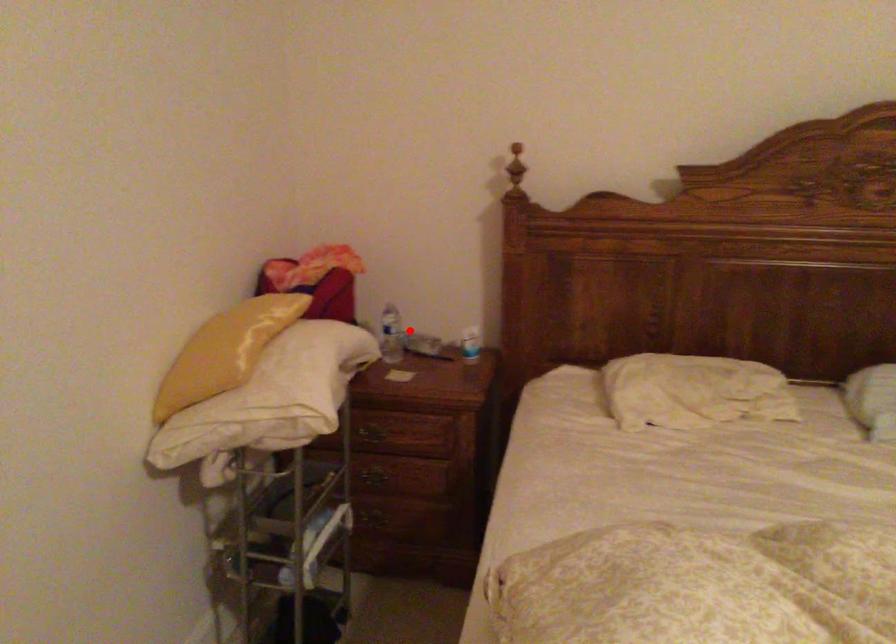
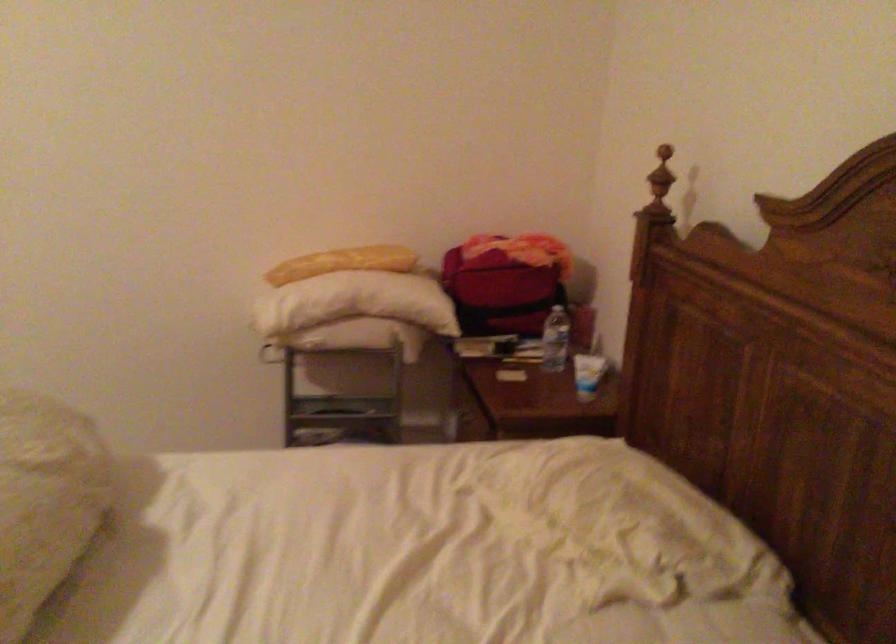
In the second image, find the point that corresponds to the highlighted location in the first image.

(556, 339)